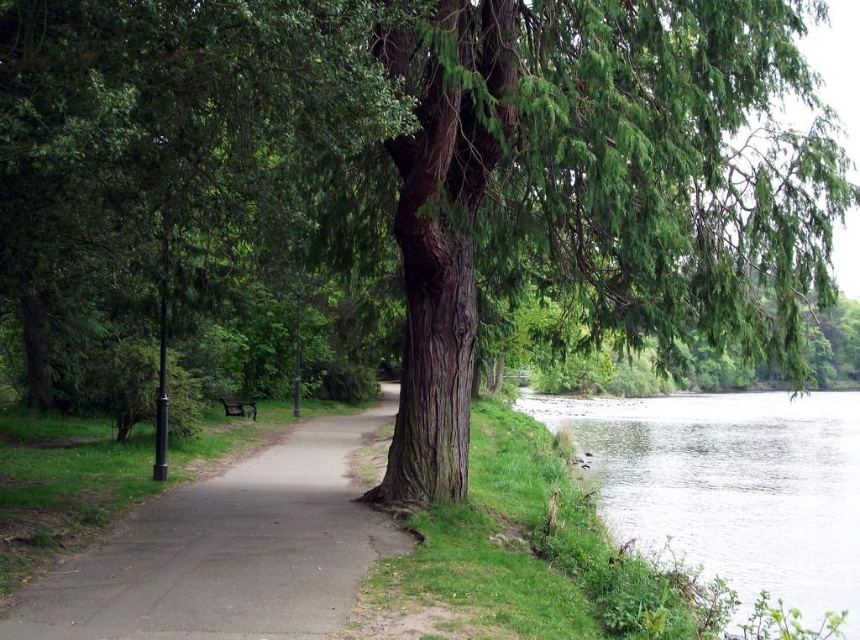
You are a person standing on the smooth asphalt path at center. You want to walk towards the green grassy river at lower right. Which direction should you move relative to the path?

The smooth asphalt path at center is in front of the green grassy river at lower right, so you should move forward along the path towards the green grassy river at lower right.

You are a maintenance worker who needs to move a 100 feet long fence from the dark brown wooden bench at center to the green grassy river at lower right. Can you fit the fence between them without bending it?

The distance between the green grassy river at lower right and the dark brown wooden bench at center is 77.64 feet. Since the fence is 100 feet long, it cannot be placed between them without bending it as the required space is shorter than the fence length.

You are standing at the riverside and want to walk along the smooth asphalt path at center. If your stride length is 2.5 feet per step, how many steps will it take you to reach the end of the path?

The smooth asphalt path at center is 18.87 feet away from the viewer. With a stride length of 2.5 feet per step, dividing the total distance by stride length gives 18.87 divided by 2.5 equals approximately 7.55 steps. Since you can only take whole steps, you would need about 8 steps to reach the end of the smooth asphalt path at center.